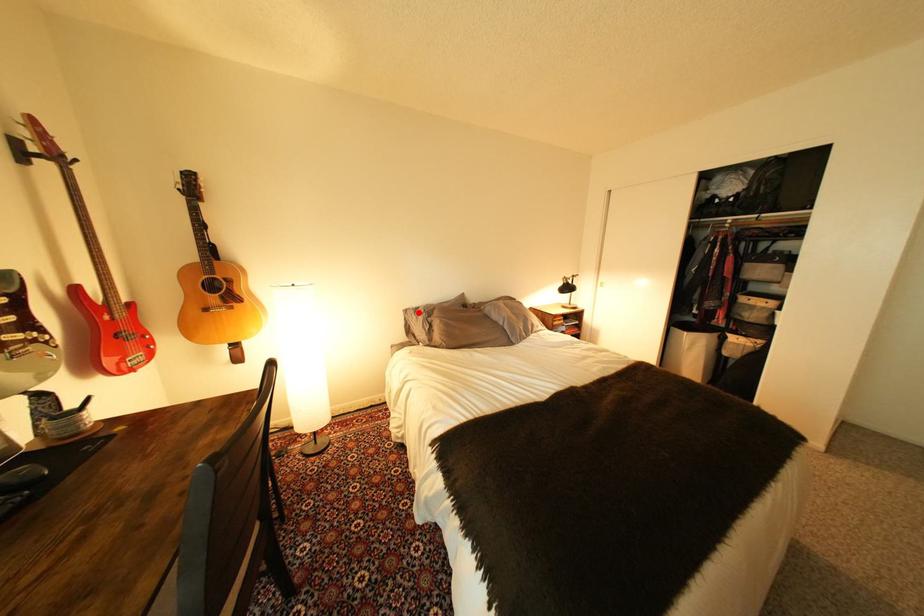
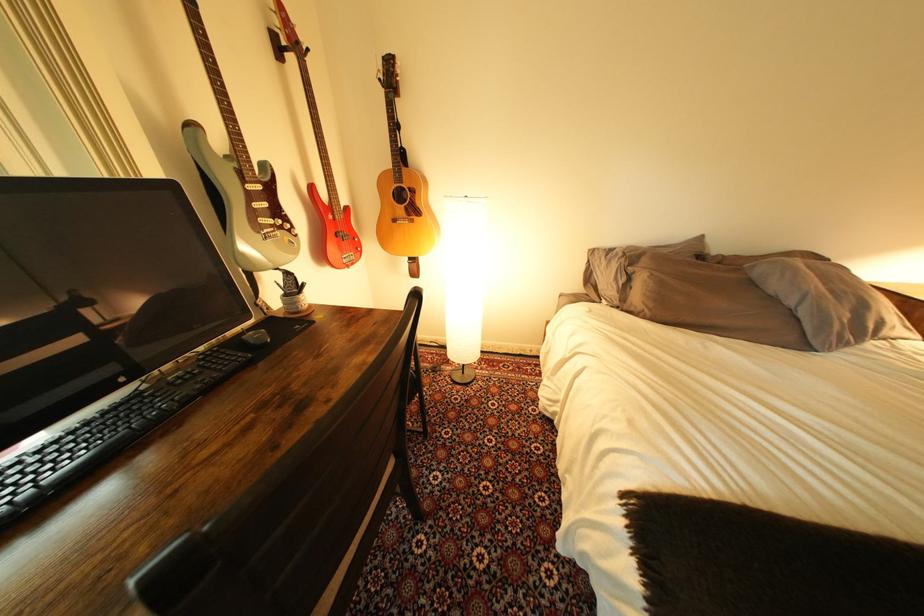
Question: A red point is marked in image1. In image2, is the corresponding 3D point closer to the camera or farther? Reply with the corresponding letter.

Choices:
 (A) The corresponding 3D point is closer.
 (B) The corresponding 3D point is farther.

Answer: (A)